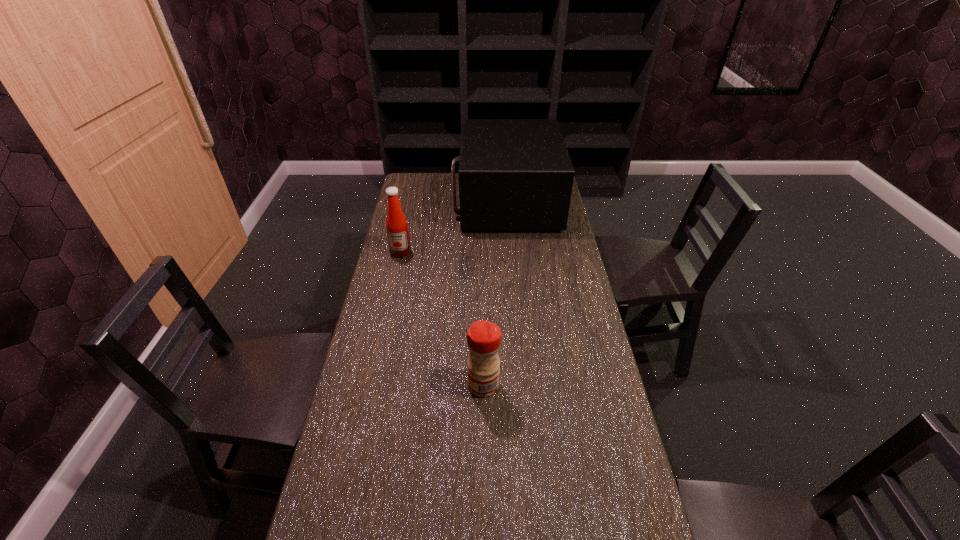
The width and height of the screenshot is (960, 540). I want to click on vacant space in between the right condiment and the microwave oven, so 495,293.

Find the location of a particular element. This screenshot has height=540, width=960. blank region between the second farthest object and the nearest object is located at coordinates (443, 319).

The width and height of the screenshot is (960, 540). Find the location of `empty space between the nearer condiment and the microwave oven`. empty space between the nearer condiment and the microwave oven is located at coordinates (495, 293).

In order to click on empty space between the right condiment and the farthest object in this screenshot , I will do `click(495, 293)`.

Find the location of `blank region between the farthest object and the left condiment`. blank region between the farthest object and the left condiment is located at coordinates (453, 227).

At what (x,y) coordinates should I click in order to perform the action: click on unoccupied area between the right condiment and the farthest object. Please return your answer as a coordinate pair (x, y). Image resolution: width=960 pixels, height=540 pixels. Looking at the image, I should click on (495, 293).

Find the location of a particular element. The image size is (960, 540). blank region between the farther condiment and the farthest object is located at coordinates (453, 227).

Where is `object that is the closest one to the farthest object`? object that is the closest one to the farthest object is located at coordinates 396,224.

Select which object appears as the second closest to the microwave oven. Please provide its 2D coordinates. Your answer should be formatted as a tuple, i.e. [(x, y)], where the tuple contains the x and y coordinates of a point satisfying the conditions above.

[(483, 337)]

The width and height of the screenshot is (960, 540). I want to click on vacant area in the image that satisfies the following two spatial constraints: 1. on the front-facing side of the right condiment; 2. on the right side of the leftmost object, so click(372, 385).